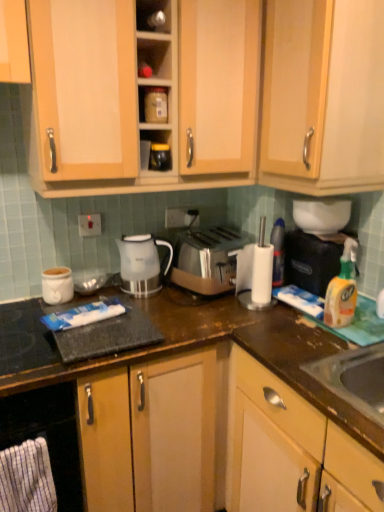
Where is `vacant region to the left of white glossy jar at left, the first appliance positioned from the left`? The image size is (384, 512). vacant region to the left of white glossy jar at left, the first appliance positioned from the left is located at coordinates (21, 303).